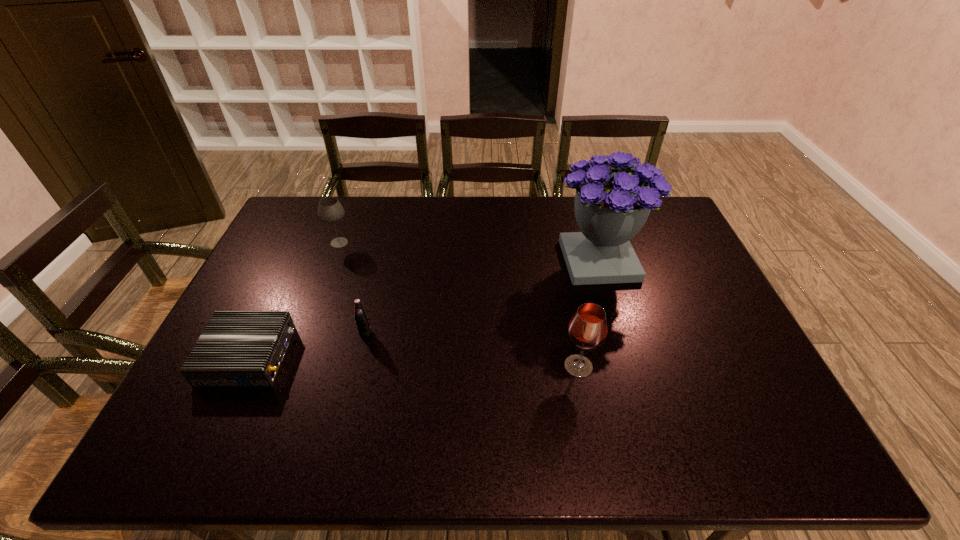
Image resolution: width=960 pixels, height=540 pixels. Find the location of `unoccupied position between the left wineglass and the tallest object`. unoccupied position between the left wineglass and the tallest object is located at coordinates (468, 252).

Identify the location of object that is the closest one to the bouquet. (587, 329).

Select which object appears as the closest to the shorter wineglass. Please provide its 2D coordinates. Your answer should be formatted as a tuple, i.e. [(x, y)], where the tuple contains the x and y coordinates of a point satisfying the conditions above.

[(237, 348)]

The height and width of the screenshot is (540, 960). Find the location of `free space in the image that satisfies the following two spatial constraints: 1. on the back side of the fourth shortest object; 2. on the back panel of the router`. free space in the image that satisfies the following two spatial constraints: 1. on the back side of the fourth shortest object; 2. on the back panel of the router is located at coordinates (577, 356).

Find the location of a particular element. free point that satisfies the following two spatial constraints: 1. on the back side of the tallest object; 2. on the right side of the nearer wineglass is located at coordinates (558, 261).

I want to click on vacant space that satisfies the following two spatial constraints: 1. on the back panel of the shortest object; 2. on the left side of the taller wineglass, so click(244, 366).

Find the location of a particular element. The image size is (960, 540). blank area in the image that satisfies the following two spatial constraints: 1. on the front side of the bouquet; 2. on the back panel of the shortest object is located at coordinates (626, 356).